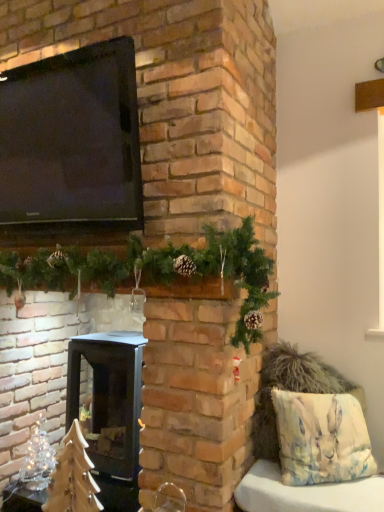
Describe the element at coordinates (72, 140) in the screenshot. I see `black glossy tv at upper left` at that location.

Image resolution: width=384 pixels, height=512 pixels. Describe the element at coordinates (152, 269) in the screenshot. I see `green pinecone garland at upper center, the 1th christmas decoration in the top-to-bottom sequence` at that location.

What are the coordinates of `green pinecone garland at upper center, arranged as the first christmas decoration when viewed from the right` in the screenshot? It's located at (152, 269).

At what (x,y) coordinates should I click in order to perform the action: click on black matte wood burning stove at center. Please return your answer as a coordinate pair (x, y). Looking at the image, I should click on (110, 412).

Is green pinecone garland at upper center, arranged as the first christmas decoration when viewed from the right, looking in the opposite direction of black glossy tv at upper left?

That's not correct — green pinecone garland at upper center, arranged as the first christmas decoration when viewed from the right, is not looking away from black glossy tv at upper left.

Is point (152, 282) positioned after point (58, 90)?

No, (152, 282) is closer to viewer.

Which of these two, green pinecone garland at upper center, the 1th christmas decoration in the top-to-bottom sequence, or black glossy tv at upper left, is thinner?

With smaller width is black glossy tv at upper left.

Can you confirm if green pinecone garland at upper center, the 1th christmas decoration in the top-to-bottom sequence, is positioned to the left of black glossy tv at upper left?

In fact, green pinecone garland at upper center, the 1th christmas decoration in the top-to-bottom sequence, is to the right of black glossy tv at upper left.

From the image's perspective, is black matte wood burning stove at center positioned above or below watercolor fabric pillow at lower right?

black matte wood burning stove at center is below watercolor fabric pillow at lower right.

Is the depth of black matte wood burning stove at center less than that of watercolor fabric pillow at lower right?

No, it is behind watercolor fabric pillow at lower right.

Does point (106, 455) come farther from viewer compared to point (367, 471)?

Yes, it is.

Do you think black matte wood burning stove at center is within watercolor fabric pillow at lower right, or outside of it?

black matte wood burning stove at center cannot be found inside watercolor fabric pillow at lower right.

From their relative heights in the image, would you say black matte wood burning stove at center is taller or shorter than green pinecone garland at upper center, marked as the 2th christmas decoration in a back-to-front arrangement?

In the image, black matte wood burning stove at center appears to be taller than green pinecone garland at upper center, marked as the 2th christmas decoration in a back-to-front arrangement.

Does black matte wood burning stove at center have a smaller size compared to green pinecone garland at upper center, marked as the second christmas decoration in a bottom-to-top arrangement?

Indeed, black matte wood burning stove at center has a smaller size compared to green pinecone garland at upper center, marked as the second christmas decoration in a bottom-to-top arrangement.

From the image's perspective, is black matte wood burning stove at center located above or below green pinecone garland at upper center, marked as the 1th christmas decoration in a front-to-back arrangement?

From the image's perspective, black matte wood burning stove at center appears below green pinecone garland at upper center, marked as the 1th christmas decoration in a front-to-back arrangement.

Does point (91, 338) come farther from viewer compared to point (254, 258)?

Yes, it is.

Relative to clear glass christmas tree at lower left, the first christmas decoration in the back-to-front sequence, is black glossy tv at upper left in front or behind?

black glossy tv at upper left is positioned closer to the viewer than clear glass christmas tree at lower left, the first christmas decoration in the back-to-front sequence.

From the image's perspective, is black glossy tv at upper left below clear glass christmas tree at lower left, the first christmas decoration in the back-to-front sequence?

No, from the image's perspective, black glossy tv at upper left is not below clear glass christmas tree at lower left, the first christmas decoration in the back-to-front sequence.

Is point (68, 60) farther from camera compared to point (25, 483)?

No, it is in front of (25, 483).

Can clear glass christmas tree at lower left, the 2th christmas decoration positioned from the top, be found inside black glossy tv at upper left?

No, clear glass christmas tree at lower left, the 2th christmas decoration positioned from the top, is not inside black glossy tv at upper left.

In the scene shown: How different are the orientations of clear glass christmas tree at lower left, the first christmas decoration in the back-to-front sequence, and black matte wood burning stove at center in degrees?

The angular difference between clear glass christmas tree at lower left, the first christmas decoration in the back-to-front sequence, and black matte wood burning stove at center is 0.000853 degrees.

Is clear glass christmas tree at lower left, which is the second christmas decoration in front-to-back order, bigger or smaller than black matte wood burning stove at center?

Considering their sizes, clear glass christmas tree at lower left, which is the second christmas decoration in front-to-back order, takes up less space than black matte wood burning stove at center.

How far apart are clear glass christmas tree at lower left, which is the first christmas decoration from bottom to top, and black matte wood burning stove at center?

The distance of clear glass christmas tree at lower left, which is the first christmas decoration from bottom to top, from black matte wood burning stove at center is 18.44 inches.

Starting from the black matte wood burning stove at center, which christmas decoration is the 2nd one to the left? Please provide its 2D coordinates.

[(37, 460)]

Does green pinecone garland at upper center, marked as the 2th christmas decoration in a back-to-front arrangement, have a lesser height compared to clear glass christmas tree at lower left, which is the first christmas decoration from bottom to top?

In fact, green pinecone garland at upper center, marked as the 2th christmas decoration in a back-to-front arrangement, may be taller than clear glass christmas tree at lower left, which is the first christmas decoration from bottom to top.

What's the angular difference between green pinecone garland at upper center, marked as the second christmas decoration in a bottom-to-top arrangement, and clear glass christmas tree at lower left, which is the first christmas decoration from bottom to top,'s facing directions?

green pinecone garland at upper center, marked as the second christmas decoration in a bottom-to-top arrangement, and clear glass christmas tree at lower left, which is the first christmas decoration from bottom to top, are facing 0.00185 degrees away from each other.

Is green pinecone garland at upper center, marked as the 1th christmas decoration in a front-to-back arrangement, outside of clear glass christmas tree at lower left, which is the 2th christmas decoration from right to left?

Absolutely, green pinecone garland at upper center, marked as the 1th christmas decoration in a front-to-back arrangement, is external to clear glass christmas tree at lower left, which is the 2th christmas decoration from right to left.

Is clear glass christmas tree at lower left, which is the second christmas decoration in front-to-back order, at the back of green pinecone garland at upper center, marked as the 1th christmas decoration in a front-to-back arrangement?

green pinecone garland at upper center, marked as the 1th christmas decoration in a front-to-back arrangement, does not have its back to clear glass christmas tree at lower left, which is the second christmas decoration in front-to-back order.

Considering the sizes of black glossy tv at upper left and black matte wood burning stove at center in the image, is black glossy tv at upper left wider or thinner than black matte wood burning stove at center?

Clearly, black glossy tv at upper left has less width compared to black matte wood burning stove at center.

From a real-world perspective, who is located lower, black glossy tv at upper left or black matte wood burning stove at center?

black matte wood burning stove at center.

From the image's perspective, which one is positioned higher, black glossy tv at upper left or black matte wood burning stove at center?

black glossy tv at upper left, from the image's perspective.

Where is `christmas decoration lying in front of the black glossy tv at upper left`? Image resolution: width=384 pixels, height=512 pixels. christmas decoration lying in front of the black glossy tv at upper left is located at coordinates (152, 269).

Where is `wood burning stove lying on the left of watercolor fabric pillow at lower right`? The image size is (384, 512). wood burning stove lying on the left of watercolor fabric pillow at lower right is located at coordinates (110, 412).

Estimate the real-world distances between objects in this image. Which object is closer to black glossy tv at upper left, black matte wood burning stove at center or clear glass christmas tree at lower left, which is the second christmas decoration in front-to-back order?

The object closer to black glossy tv at upper left is black matte wood burning stove at center.

When comparing their distances from watercolor fabric pillow at lower right, does clear glass christmas tree at lower left, the 2th christmas decoration positioned from the top, or black matte wood burning stove at center seem closer?

black matte wood burning stove at center is positioned closer to the anchor watercolor fabric pillow at lower right.

When comparing their distances from clear glass christmas tree at lower left, which is the first christmas decoration from bottom to top, does green pinecone garland at upper center, marked as the second christmas decoration in a bottom-to-top arrangement, or black matte wood burning stove at center seem further?

Among the two, green pinecone garland at upper center, marked as the second christmas decoration in a bottom-to-top arrangement, is located further to clear glass christmas tree at lower left, which is the first christmas decoration from bottom to top.

Estimate the real-world distances between objects in this image. Which object is further from watercolor fabric pillow at lower right, clear glass christmas tree at lower left, the first christmas decoration in the back-to-front sequence, or green pinecone garland at upper center, marked as the 2th christmas decoration in a back-to-front arrangement?

Among the two, clear glass christmas tree at lower left, the first christmas decoration in the back-to-front sequence, is located further to watercolor fabric pillow at lower right.

Looking at the image, which one is located further to clear glass christmas tree at lower left, the first christmas decoration viewed from the left, watercolor fabric pillow at lower right or black matte wood burning stove at center?

Among the two, watercolor fabric pillow at lower right is located further to clear glass christmas tree at lower left, the first christmas decoration viewed from the left.

Considering their positions, is green pinecone garland at upper center, marked as the second christmas decoration in a bottom-to-top arrangement, positioned closer to black glossy tv at upper left than clear glass christmas tree at lower left, which is the first christmas decoration from bottom to top?

Based on the image, green pinecone garland at upper center, marked as the second christmas decoration in a bottom-to-top arrangement, appears to be nearer to black glossy tv at upper left.

Estimate the real-world distances between objects in this image. Which object is further from black glossy tv at upper left, clear glass christmas tree at lower left, the first christmas decoration viewed from the left, or watercolor fabric pillow at lower right?

Among the two, clear glass christmas tree at lower left, the first christmas decoration viewed from the left, is located further to black glossy tv at upper left.

From the image, which object appears to be farther from black glossy tv at upper left, clear glass christmas tree at lower left, which is the first christmas decoration from bottom to top, or black matte wood burning stove at center?

Among the two, clear glass christmas tree at lower left, which is the first christmas decoration from bottom to top, is located further to black glossy tv at upper left.

You are a GUI agent. You are given a task and a screenshot of the screen. Output one action in this format:
    pyautogui.click(x=<x>, y=<y>)
    Task: Click on the christmas decoration between black glossy tv at upper left and clear glass christmas tree at lower left, which is the second christmas decoration in front-to-back order, from top to bottom
    Image resolution: width=384 pixels, height=512 pixels.
    Given the screenshot: What is the action you would take?
    pyautogui.click(x=152, y=269)

The image size is (384, 512). Identify the location of wood burning stove situated between clear glass christmas tree at lower left, which is the second christmas decoration in front-to-back order, and watercolor fabric pillow at lower right from left to right. (110, 412).

I want to click on christmas decoration located between black glossy tv at upper left and watercolor fabric pillow at lower right in the left-right direction, so click(x=152, y=269).

The height and width of the screenshot is (512, 384). Identify the location of christmas decoration between black glossy tv at upper left and black matte wood burning stove at center in the up-down direction. (152, 269).